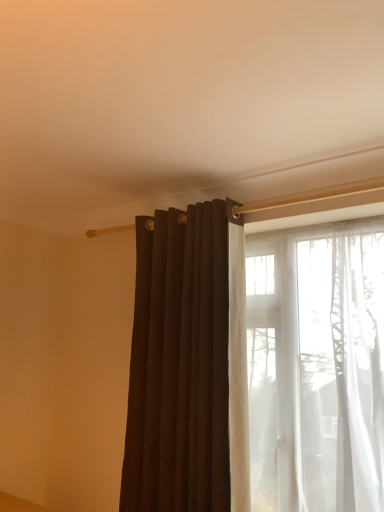
The height and width of the screenshot is (512, 384). Describe the element at coordinates (179, 364) in the screenshot. I see `matte dark brown curtain at center` at that location.

What is the approximate width of matte dark brown curtain at center?

6.20 inches.

Measure the distance between matte dark brown curtain at center and camera.

The depth of matte dark brown curtain at center is 1.56 meters.

You are a GUI agent. You are given a task and a screenshot of the screen. Output one action in this format:
    pyautogui.click(x=<x>, y=<y>)
    Task: Click on the matte dark brown curtain at center
    Image resolution: width=384 pixels, height=512 pixels.
    Given the screenshot: What is the action you would take?
    pyautogui.click(x=179, y=364)

The image size is (384, 512). I want to click on translucent white curtain at right, so click(309, 368).

Image resolution: width=384 pixels, height=512 pixels. What do you see at coordinates (309, 368) in the screenshot?
I see `translucent white curtain at right` at bounding box center [309, 368].

Identify the location of matte dark brown curtain at center. This screenshot has height=512, width=384. (179, 364).

Is matte dark brown curtain at center at the right side of translucent white curtain at right?

No, matte dark brown curtain at center is not to the right of translucent white curtain at right.

Is matte dark brown curtain at center in front of or behind translucent white curtain at right in the image?

In the image, matte dark brown curtain at center appears behind translucent white curtain at right.

Considering the positions of point (177, 346) and point (312, 239), is point (177, 346) closer or farther from the camera than point (312, 239)?

Point (177, 346) is closer to the camera than point (312, 239).

From the image's perspective, is matte dark brown curtain at center beneath translucent white curtain at right?

No, from the image's perspective, matte dark brown curtain at center is not beneath translucent white curtain at right.

From a real-world perspective, relative to translucent white curtain at right, is matte dark brown curtain at center vertically above or below?

matte dark brown curtain at center is above translucent white curtain at right.

Between matte dark brown curtain at center and translucent white curtain at right, which one has larger width?

translucent white curtain at right.

Considering the sizes of objects matte dark brown curtain at center and translucent white curtain at right in the image provided, who is shorter, matte dark brown curtain at center or translucent white curtain at right?

translucent white curtain at right.

Based on the photo, considering the relative sizes of matte dark brown curtain at center and translucent white curtain at right in the image provided, is matte dark brown curtain at center smaller than translucent white curtain at right?

Indeed, matte dark brown curtain at center has a smaller size compared to translucent white curtain at right.

Would you say matte dark brown curtain at center contains translucent white curtain at right?

No.

Is there a large distance between matte dark brown curtain at center and translucent white curtain at right?

No, matte dark brown curtain at center is in close proximity to translucent white curtain at right.

Could you tell me if matte dark brown curtain at center is turned towards translucent white curtain at right?

No, matte dark brown curtain at center is not facing towards translucent white curtain at right.

Can you tell me how much matte dark brown curtain at center and translucent white curtain at right differ in facing direction?

There is a 1.42-degree angle between the facing directions of matte dark brown curtain at center and translucent white curtain at right.

Image resolution: width=384 pixels, height=512 pixels. I want to click on window in front of the matte dark brown curtain at center, so click(x=309, y=368).

Visually, is translucent white curtain at right positioned to the left or to the right of matte dark brown curtain at center?

translucent white curtain at right is positioned on matte dark brown curtain at center's right side.

Is translucent white curtain at right in front of or behind matte dark brown curtain at center in the image?

In the image, translucent white curtain at right appears in front of matte dark brown curtain at center.

Which is less distant, (325, 387) or (227, 273)?

The point (325, 387) is closer.

From the image's perspective, does translucent white curtain at right appear lower than matte dark brown curtain at center?

Yes.

From a real-world perspective, is translucent white curtain at right physically located above or below matte dark brown curtain at center?

translucent white curtain at right is below matte dark brown curtain at center.

Considering the relative sizes of translucent white curtain at right and matte dark brown curtain at center in the image provided, is translucent white curtain at right thinner than matte dark brown curtain at center?

No.

From their relative heights in the image, would you say translucent white curtain at right is taller or shorter than matte dark brown curtain at center?

In the image, translucent white curtain at right appears to be shorter than matte dark brown curtain at center.

Does translucent white curtain at right have a larger size compared to matte dark brown curtain at center?

Indeed, translucent white curtain at right has a larger size compared to matte dark brown curtain at center.

Would you say translucent white curtain at right is outside matte dark brown curtain at center?

Yes, translucent white curtain at right is not within matte dark brown curtain at center.

Looking at this image, can you see translucent white curtain at right touching matte dark brown curtain at center?

No.

Is translucent white curtain at right oriented towards matte dark brown curtain at center?

No, translucent white curtain at right is not oriented towards matte dark brown curtain at center.

Can you tell me how much translucent white curtain at right and matte dark brown curtain at center differ in facing direction?

translucent white curtain at right and matte dark brown curtain at center are facing 1.42 degrees away from each other.

Identify the location of window below the matte dark brown curtain at center (from a real-world perspective). (309, 368).

This screenshot has height=512, width=384. In order to click on curtain above the translucent white curtain at right (from the image's perspective) in this screenshot , I will do `click(179, 364)`.

In the image, there is a matte dark brown curtain at center. Where is `window below it (from the image's perspective)`? Image resolution: width=384 pixels, height=512 pixels. window below it (from the image's perspective) is located at coordinates (309, 368).